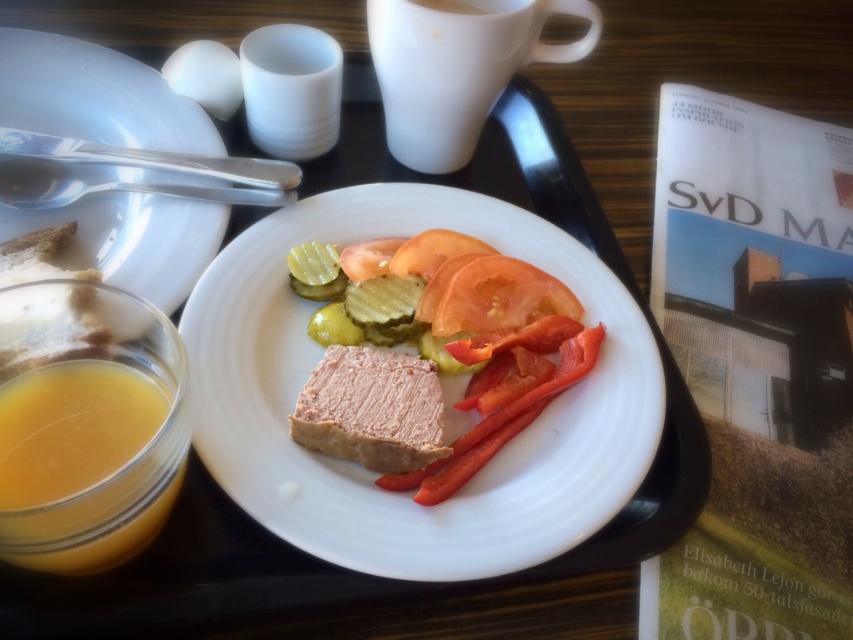
Consider the image. You are a person with a 12 inch long arm. You want to reach the white matte plate at center on the breakfast tray. Can you reach it?

The white matte plate at center is 15.96 inches away from the viewer. Since your arm is only 12 inches long, you cannot reach it without moving closer.

You are a chef standing at a distance of 16 inches from the wooden table. You need to reach the white matte plate at center to add a garnish. Can you just barely touch it with your hand without moving your body?

The white matte plate at center is 15.96 inches from viewer, so yes, you can just barely touch it with your hand without moving your body since the distance is slightly less than your reach of 16 inches.